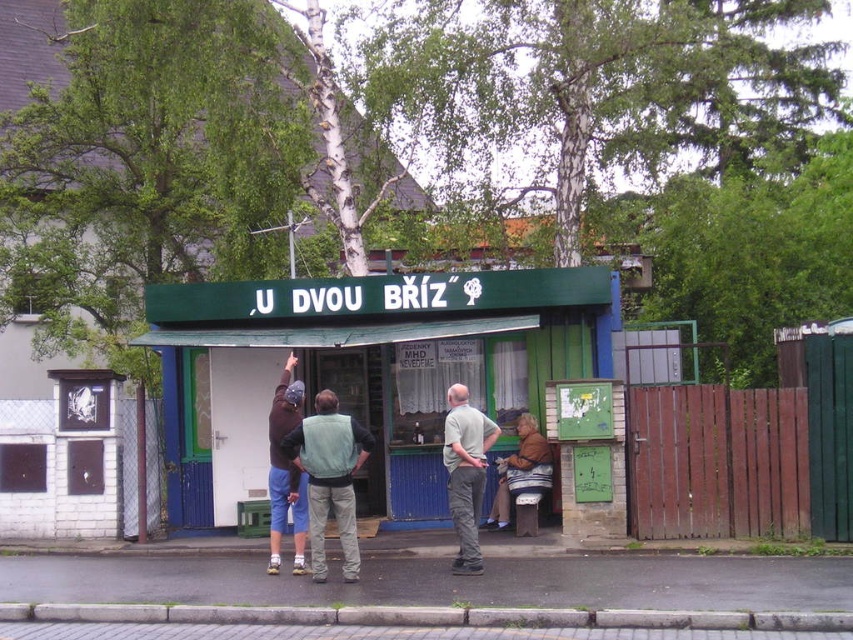
Is green painted wood signboard at center bigger than khaki pants at center?

Correct, green painted wood signboard at center is larger in size than khaki pants at center.

Where is `green painted wood signboard at center`? Image resolution: width=853 pixels, height=640 pixels. green painted wood signboard at center is located at coordinates (364, 348).

Between khaki pants at center and dark brown fabric jacket at center, which one is positioned higher?

dark brown fabric jacket at center is higher up.

Is khaki pants at center wider than dark brown fabric jacket at center?

Indeed, khaki pants at center has a greater width compared to dark brown fabric jacket at center.

Is point (461, 465) farther from camera compared to point (299, 481)?

No, it is not.

The width and height of the screenshot is (853, 640). I want to click on khaki pants at center, so click(465, 472).

Is green painted wood signboard at center below light green vest at center?

Actually, green painted wood signboard at center is above light green vest at center.

Can you confirm if green painted wood signboard at center is shorter than light green vest at center?

Incorrect, green painted wood signboard at center's height does not fall short of light green vest at center's.

At what (x,y) coordinates should I click in order to perform the action: click on green painted wood signboard at center. Please return your answer as a coordinate pair (x, y). Looking at the image, I should click on [364, 348].